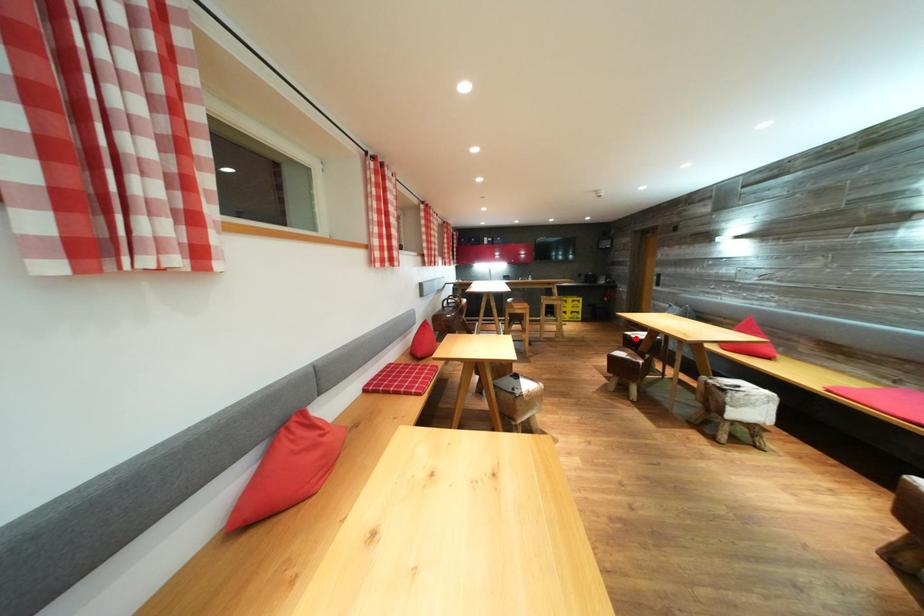
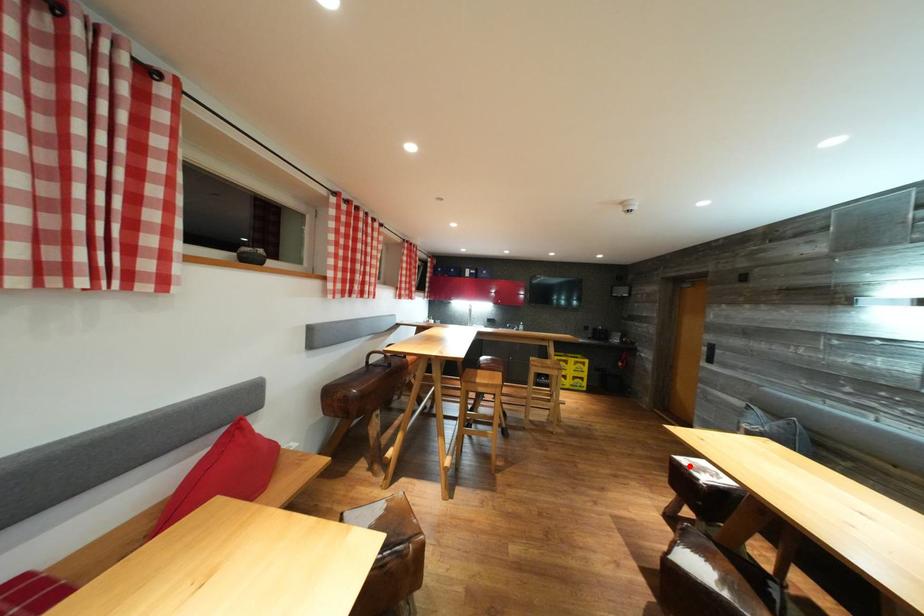
I am providing you with two images of the same scene from different viewpoints. A red point is marked on the first image and another point is marked on the second image. Is the marked point in image1 the same physical position as the marked point in image2?

Yes